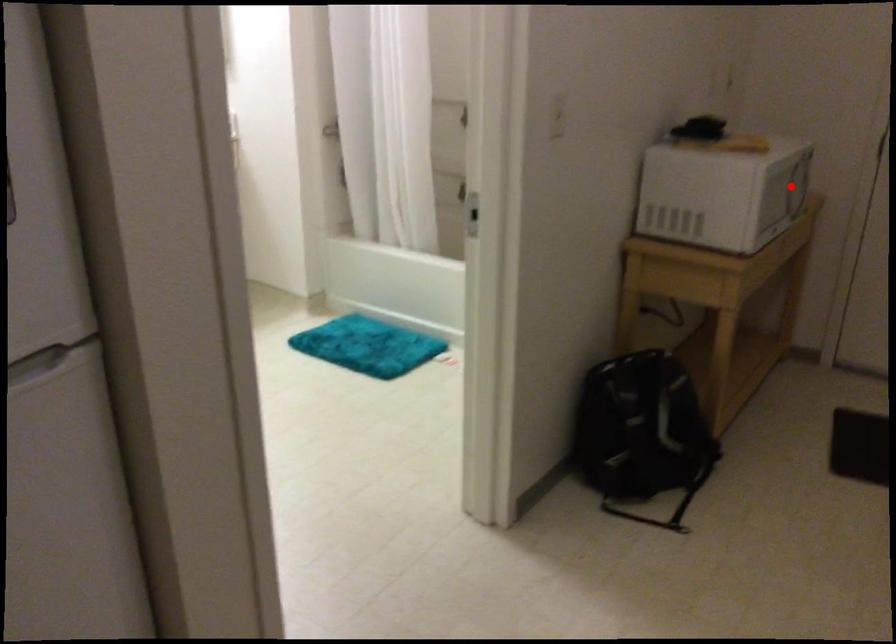
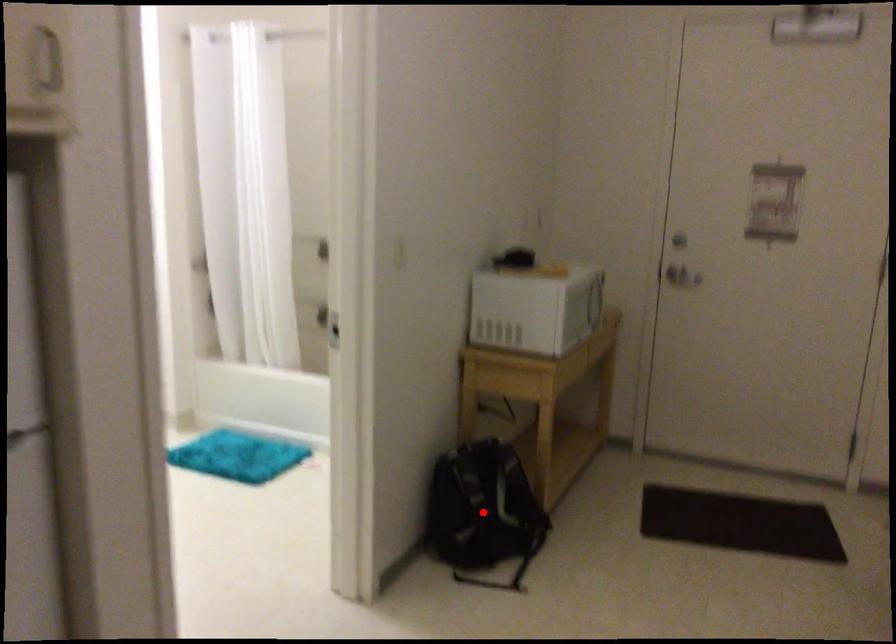
I am providing you with two images of the same scene from different viewpoints. A red point is marked on the first image and another point is marked on the second image. Is the red point in image1 aligned with the point shown in image2?

No